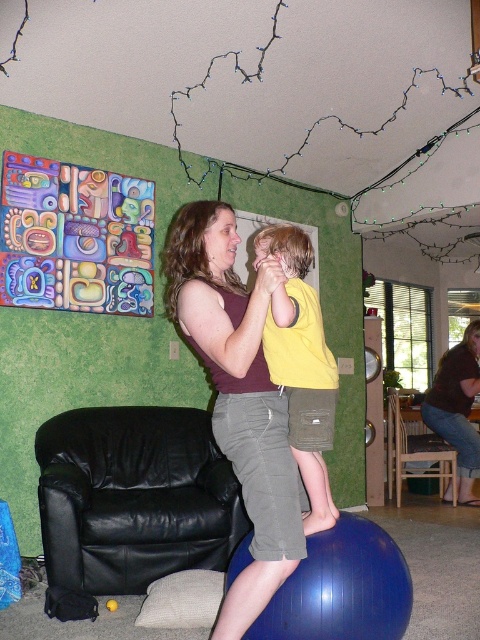
Is black leather armchair at left smaller than brown wooden chair at lower right?

Actually, black leather armchair at left might be larger than brown wooden chair at lower right.

Which of these two, black leather armchair at left or brown wooden chair at lower right, stands taller?

Standing taller between the two is brown wooden chair at lower right.

What do you see at coordinates (133, 497) in the screenshot?
I see `black leather armchair at left` at bounding box center [133, 497].

Locate an element on the screen. The height and width of the screenshot is (640, 480). black leather armchair at left is located at coordinates (133, 497).

Based on the photo, does yellow matte shirt at center have a lesser height compared to matte brown shirt at center?

Correct, yellow matte shirt at center is not as tall as matte brown shirt at center.

Is yellow matte shirt at center bigger than matte brown shirt at center?

No, yellow matte shirt at center is not bigger than matte brown shirt at center.

Which is behind, point (333, 360) or point (471, 374)?

Positioned behind is point (471, 374).

At what (x,y) coordinates should I click in order to perform the action: click on yellow matte shirt at center. Please return your answer as a coordinate pair (x, y). Looking at the image, I should click on (300, 364).

Is matte purple tank top at center positioned in front of brown wooden chair at lower right?

Yes, it is.

Find the location of a particular element. matte purple tank top at center is located at coordinates (238, 396).